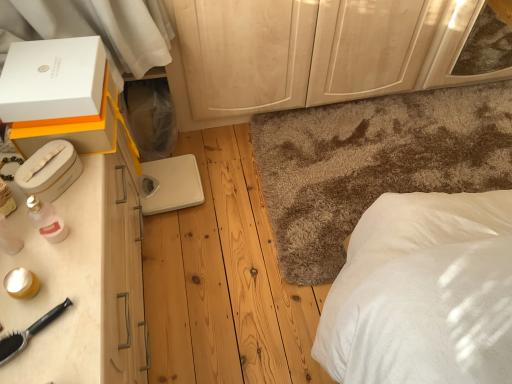
Identify the location of free space behind black plastic brush at lower left. The height and width of the screenshot is (384, 512). (49, 256).